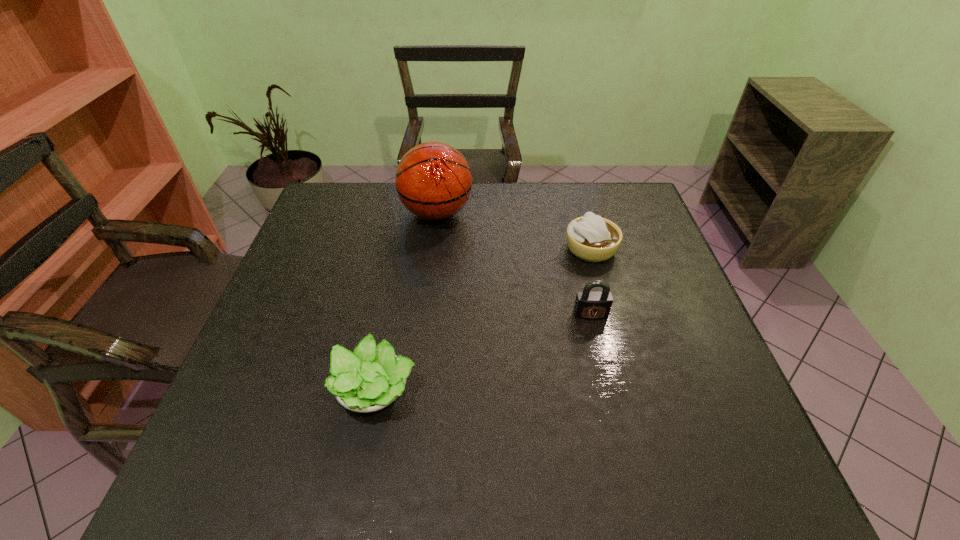
Identify the location of vacant space in between the basketball and the second nearest object. This screenshot has height=540, width=960. (514, 264).

Where is `vacant space that's between the lettuce and the padlock`? This screenshot has height=540, width=960. vacant space that's between the lettuce and the padlock is located at coordinates (483, 352).

Locate an element on the screen. free space between the shortest object and the whipped cream is located at coordinates (484, 320).

Locate an element on the screen. Image resolution: width=960 pixels, height=540 pixels. free spot between the nearest object and the whipped cream is located at coordinates tap(484, 320).

At what (x,y) coordinates should I click in order to perform the action: click on free spot between the shortest object and the padlock. Please return your answer as a coordinate pair (x, y). Looking at the image, I should click on (483, 352).

You are a GUI agent. You are given a task and a screenshot of the screen. Output one action in this format:
    pyautogui.click(x=<x>, y=<y>)
    Task: Click on the free spot between the lettuce and the basketball
    The height and width of the screenshot is (540, 960).
    Given the screenshot: What is the action you would take?
    (x=406, y=302)

Where is `vacant point located between the tallest object and the nearest object`? vacant point located between the tallest object and the nearest object is located at coordinates point(406,302).

At what (x,y) coordinates should I click in order to perform the action: click on vacant space that's between the whipped cream and the padlock. Please return your answer as a coordinate pair (x, y). The height and width of the screenshot is (540, 960). Looking at the image, I should click on (590, 282).

Identify the location of object that is the third closest to the second nearest object. Image resolution: width=960 pixels, height=540 pixels. (433, 180).

Identify which object is located as the third nearest to the tallest object. Please provide its 2D coordinates. Your answer should be formatted as a tuple, i.e. [(x, y)], where the tuple contains the x and y coordinates of a point satisfying the conditions above.

[(369, 379)]